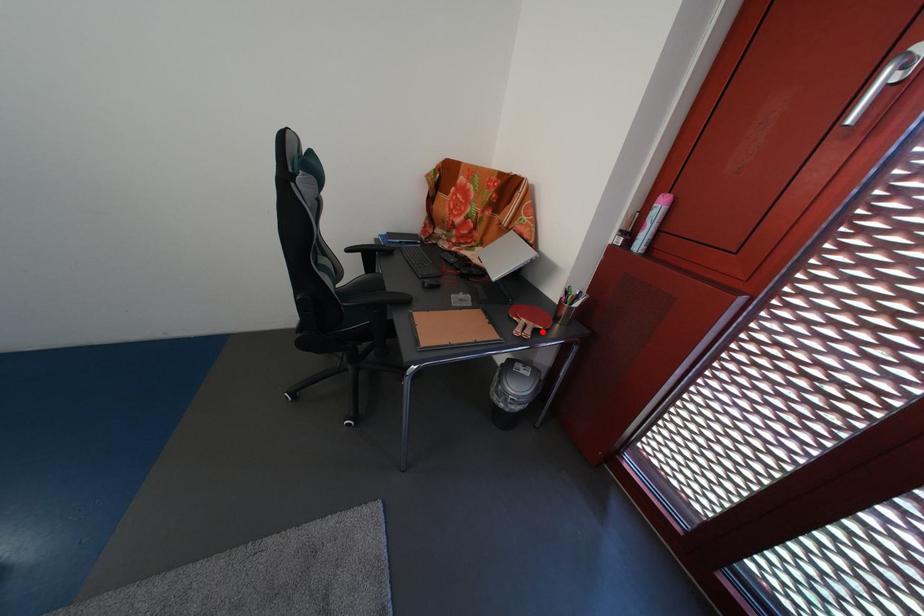
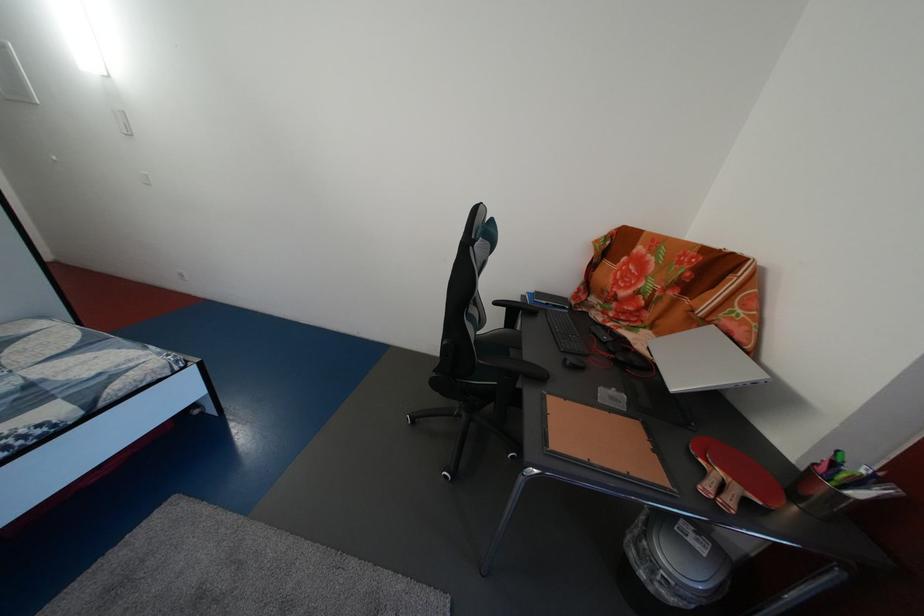
Find the pixel in the second image that matches the highlighted location in the first image.

(748, 496)